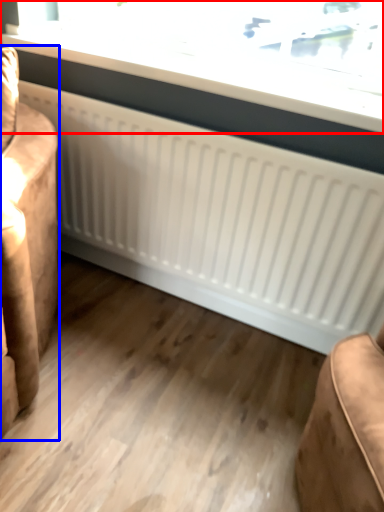
Question: Among these objects, which one is farthest to the camera, window (highlighted by a red box) or furniture (highlighted by a blue box)?

Choices:
 (A) window
 (B) furniture

Answer: (A)